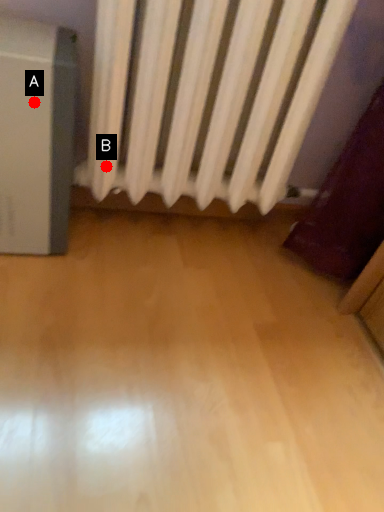
Question: Two points are circled on the image, labeled by A and B beside each circle. Which of the following is the closest to the observer?

Choices:
 (A) A is closer
 (B) B is closer

Answer: (A)